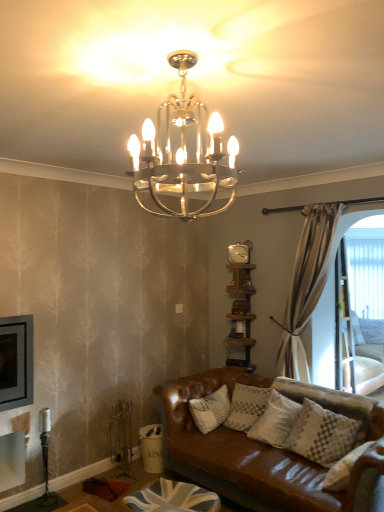
Question: From the image's perspective, is white mesh screen at right under metallic chandelier at upper center?

Choices:
 (A) yes
 (B) no

Answer: (A)

Question: Is white mesh screen at right facing away from metallic chandelier at upper center?

Choices:
 (A) yes
 (B) no

Answer: (B)

Question: Is metallic chandelier at upper center surrounded by white mesh screen at right?

Choices:
 (A) no
 (B) yes

Answer: (A)

Question: Does white mesh screen at right turn towards metallic chandelier at upper center?

Choices:
 (A) yes
 (B) no

Answer: (B)

Question: From a real-world perspective, is white mesh screen at right below metallic chandelier at upper center?

Choices:
 (A) yes
 (B) no

Answer: (A)

Question: Is point (244, 286) positioned closer to the camera than point (163, 147)?

Choices:
 (A) farther
 (B) closer

Answer: (A)

Question: From a real-world perspective, is brown wooden shelf at right positioned above or below metallic chandelier at upper center?

Choices:
 (A) above
 (B) below

Answer: (B)

Question: From the image's perspective, is brown wooden shelf at right above or below metallic chandelier at upper center?

Choices:
 (A) below
 (B) above

Answer: (A)

Question: Looking at their shapes, would you say brown wooden shelf at right is wider or thinner than metallic chandelier at upper center?

Choices:
 (A) wide
 (B) thin

Answer: (B)

Question: Is union jack fabric footrest at lower center inside or outside of white mesh screen at right?

Choices:
 (A) inside
 (B) outside

Answer: (B)

Question: From their relative heights in the image, would you say union jack fabric footrest at lower center is taller or shorter than white mesh screen at right?

Choices:
 (A) tall
 (B) short

Answer: (B)

Question: Looking at their shapes, would you say union jack fabric footrest at lower center is wider or thinner than white mesh screen at right?

Choices:
 (A) thin
 (B) wide

Answer: (B)

Question: From a real-world perspective, is union jack fabric footrest at lower center above or below white mesh screen at right?

Choices:
 (A) above
 (B) below

Answer: (B)

Question: Is metallic chandelier at upper center inside the boundaries of union jack fabric footrest at lower center, or outside?

Choices:
 (A) outside
 (B) inside

Answer: (A)

Question: From the image's perspective, is metallic chandelier at upper center above or below union jack fabric footrest at lower center?

Choices:
 (A) above
 (B) below

Answer: (A)